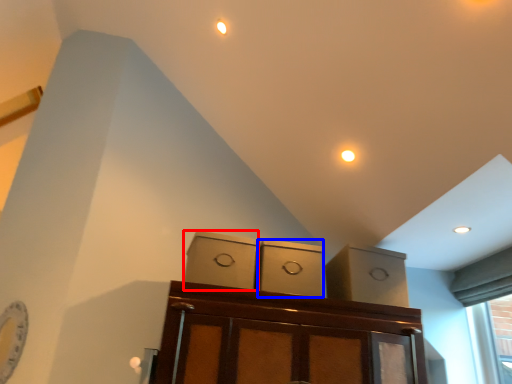
Question: Which of the following is the closest to the observer, cabinetry (highlighted by a red box) or cabinetry (highlighted by a blue box)?

Choices:
 (A) cabinetry
 (B) cabinetry

Answer: (A)